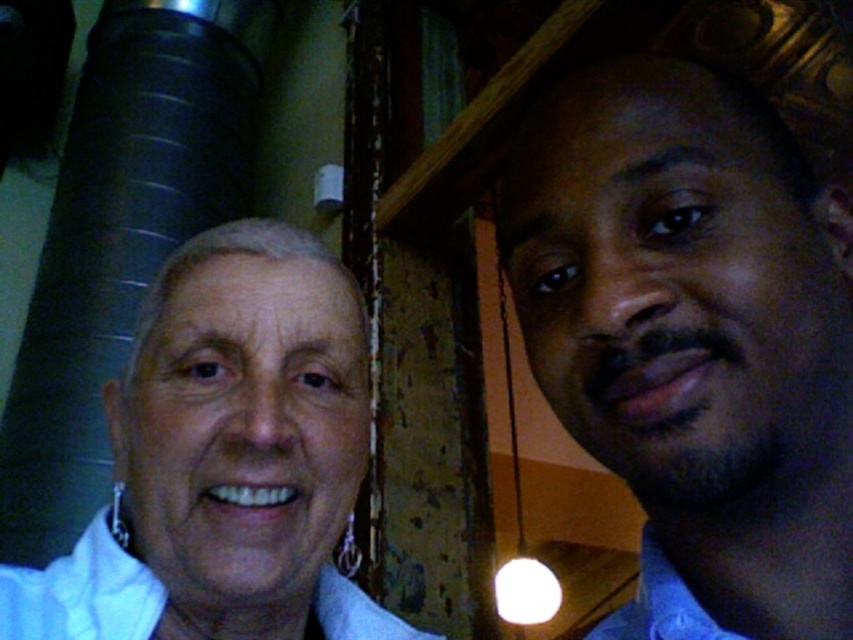
Question: Which of the following is the closest to the observer?

Choices:
 (A) (122, 605)
 (B) (135, 422)

Answer: (A)

Question: Which object is the closest to the white matte/soft skin at center?

Choices:
 (A) smooth skin face at right
 (B) white cotton dress shirt at lower left

Answer: (B)

Question: Can you confirm if smooth skin face at right is bigger than white matte/soft skin at center?

Choices:
 (A) yes
 (B) no

Answer: (B)

Question: Does white matte/soft skin at center appear on the right side of white cotton dress shirt at lower left?

Choices:
 (A) yes
 (B) no

Answer: (B)

Question: Is smooth skin face at right below white matte/soft skin at center?

Choices:
 (A) yes
 (B) no

Answer: (B)

Question: Which of the following is the farthest from the observer?

Choices:
 (A) (538, 148)
 (B) (358, 419)
 (C) (337, 616)

Answer: (C)